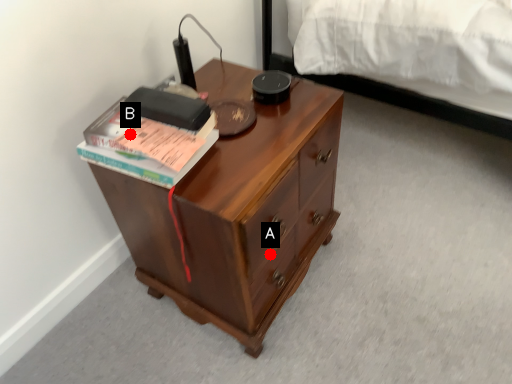
Question: Two points are circled on the image, labeled by A and B beside each circle. Which of the following is the closest to the observer?

Choices:
 (A) A is closer
 (B) B is closer

Answer: (B)